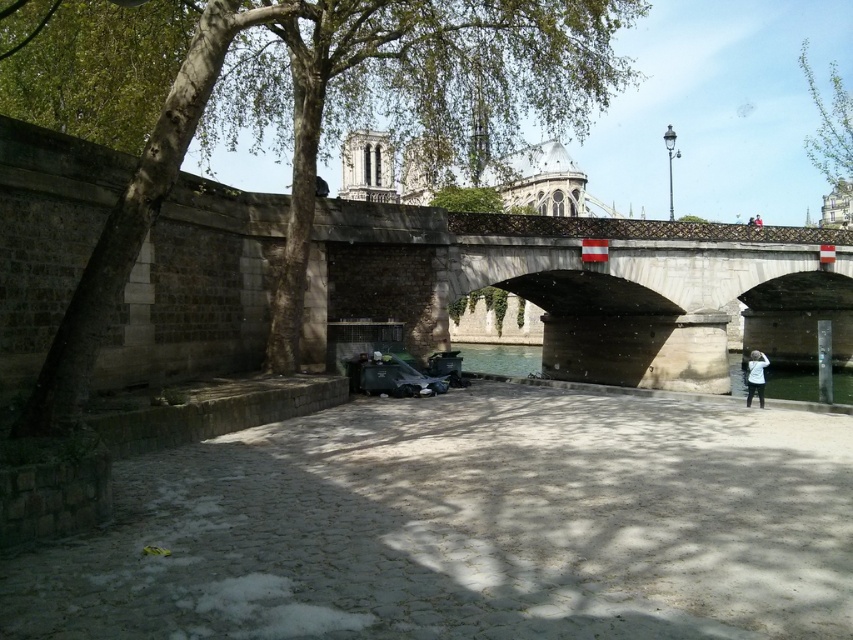
You are a photographer planning to capture a wide shot of the green leafy tree at upper right and the white matte jacket at lower right in the scene. Given the distance between them, do you think you can fit both subjects into a single frame without moving your camera position? Please explain your reasoning.

The distance between the green leafy tree at upper right and the white matte jacket at lower right is 172.75 meters. Since this distance is quite large, it would be challenging to capture both subjects in a single frame without moving the camera position unless using a wide angle lens or a high zoom capability.

You are a photographer planning to take a photo of the green leafy tree at upper right and the white matte jacket at lower right. Which object should you focus on first if you want to capture both in a single frame without moving the camera?

The green leafy tree at upper right is above the white matte jacket at lower right, so you should focus on the green leafy tree at upper right first to ensure both are in focus since it is farther away.

You are standing at the edge of the clear concrete waterway at center and want to throw a small pebble into the water. If you can throw a pebble 60 meters, will it reach the waterway?

The clear concrete waterway at center is 63.29 meters away from the viewer. Since you can only throw a pebble 60 meters, it will not reach the waterway.